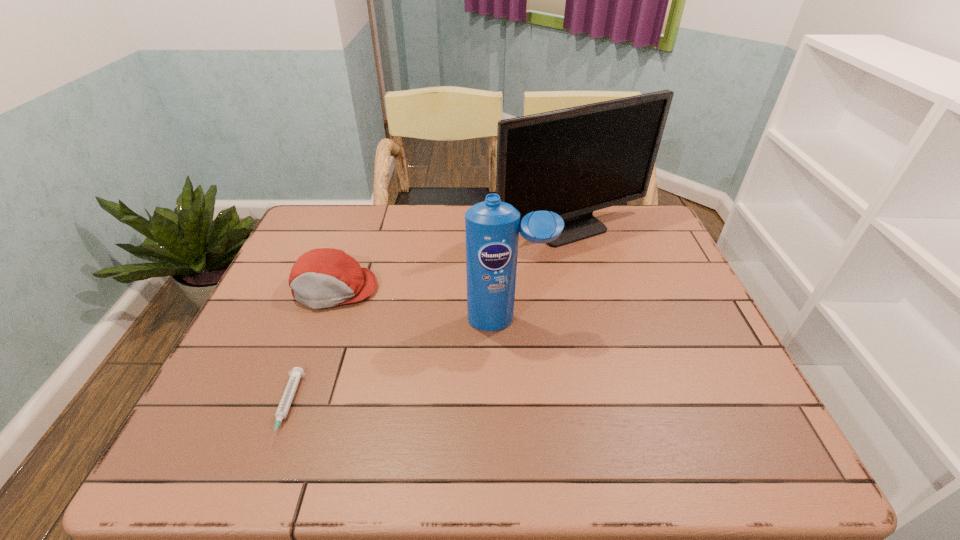
At what (x,y) coordinates should I click in order to perform the action: click on object identified as the third closest to the shampoo. Please return your answer as a coordinate pair (x, y). The image size is (960, 540). Looking at the image, I should click on (297, 372).

Locate which object ranks second in proximity to the farthest object. Please provide its 2D coordinates. Your answer should be formatted as a tuple, i.e. [(x, y)], where the tuple contains the x and y coordinates of a point satisfying the conditions above.

[(324, 277)]

The height and width of the screenshot is (540, 960). Identify the location of free space that satisfies the following two spatial constraints: 1. on the front-facing side of the shampoo; 2. on the left side of the cap. (324, 321).